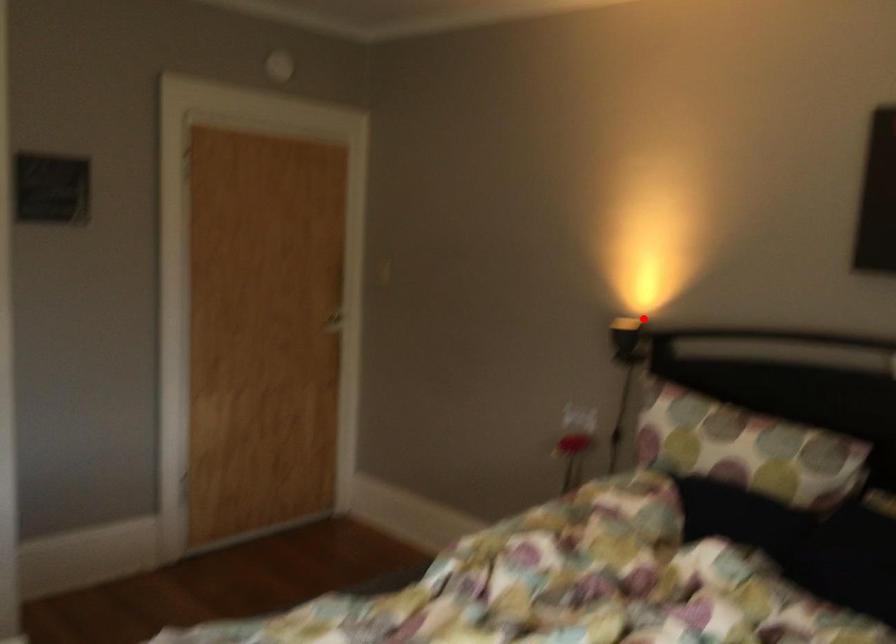
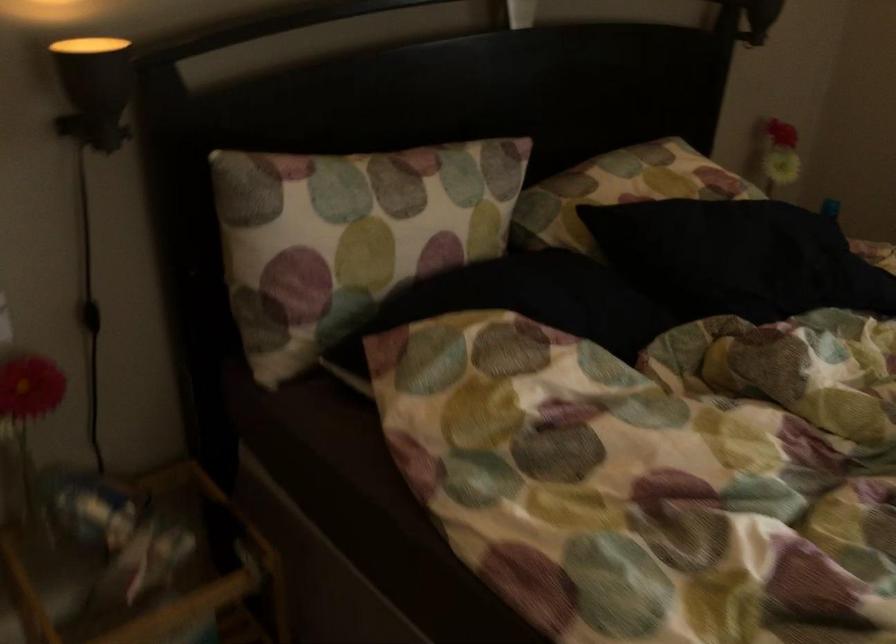
Question: I am providing you with two images of the same scene from different viewpoints. A red point is shown in image1. For the corresponding object point in image2, is it positioned nearer or farther from the camera?

Choices:
 (A) Nearer
 (B) Farther

Answer: (A)